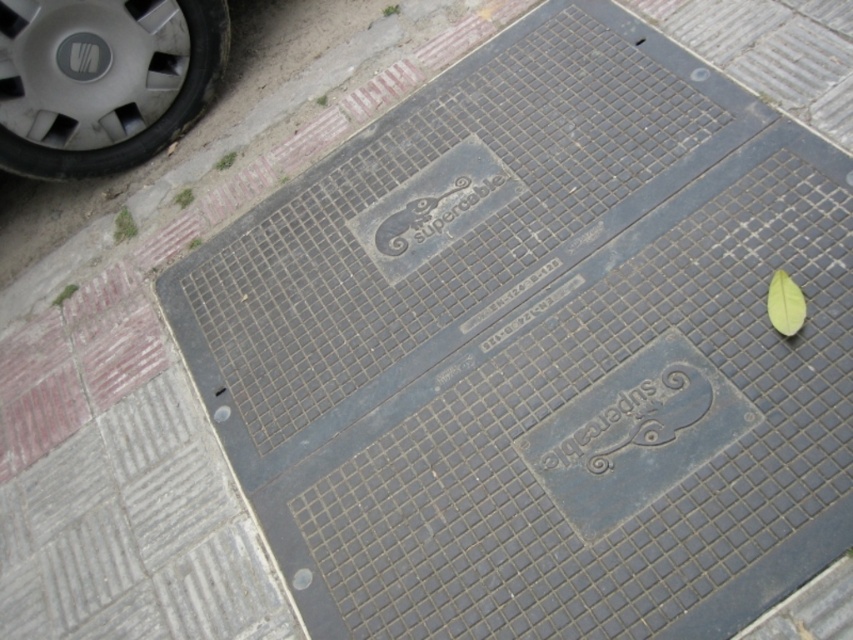
Question: Can you confirm if metallic gray tire at upper left is positioned to the left of green matte leaf at upper right?

Choices:
 (A) yes
 (B) no

Answer: (A)

Question: Is metallic gray tire at upper left above green matte leaf at upper right?

Choices:
 (A) yes
 (B) no

Answer: (A)

Question: From the image, what is the correct spatial relationship of metallic gray tire at upper left in relation to green matte leaf at upper right?

Choices:
 (A) below
 (B) above

Answer: (B)